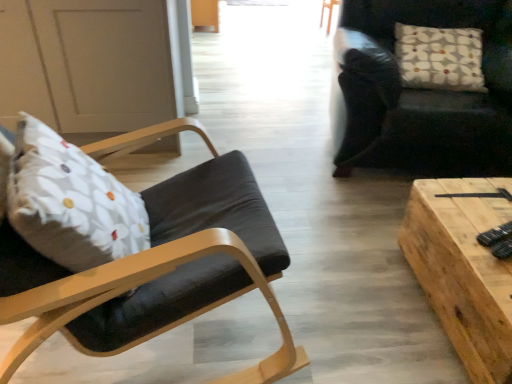
Question: Considering the positions of black plastic remote control at lower right and wooden plank table at center in the image, is black plastic remote control at lower right wider or thinner than wooden plank table at center?

Choices:
 (A) thin
 (B) wide

Answer: (A)

Question: Is black plastic remote control at lower right inside the boundaries of wooden plank table at center, or outside?

Choices:
 (A) inside
 (B) outside

Answer: (B)

Question: Based on their relative distances, which object is nearer to the white floral fabric pillow at upper right?

Choices:
 (A) dark leather chair at upper right, which ranks as the second chair in left-to-right order
 (B) wooden plank table at center
 (C) matte black chair at left, the first chair viewed from the left
 (D) black plastic remote control at lower right

Answer: (A)

Question: Estimate the real-world distances between objects in this image. Which object is closer to the dark leather chair at upper right, which ranks as the second chair in left-to-right order?

Choices:
 (A) matte black chair at left, the 1th chair in the front-to-back sequence
 (B) black plastic remote control at lower right
 (C) white floral fabric pillow at upper right
 (D) wooden plank table at center

Answer: (C)